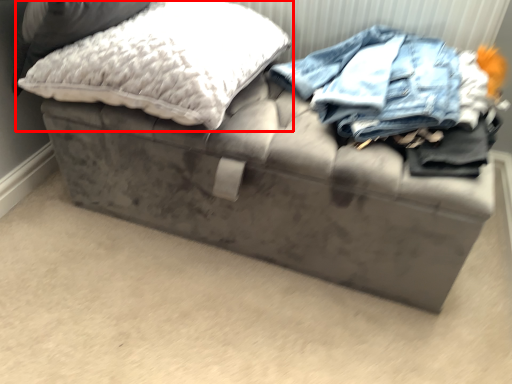
Question: Where is pillow (annotated by the red box) located in relation to pillow in the image?

Choices:
 (A) left
 (B) right

Answer: (B)